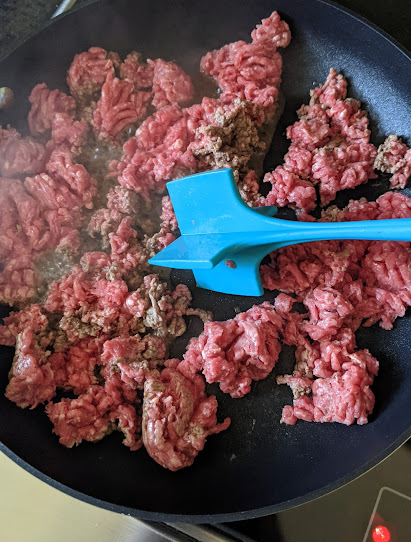
The width and height of the screenshot is (411, 542). I want to click on steam is coming off of the pan here, so click(98, 157), click(193, 74), click(101, 34), click(183, 36), click(41, 82).